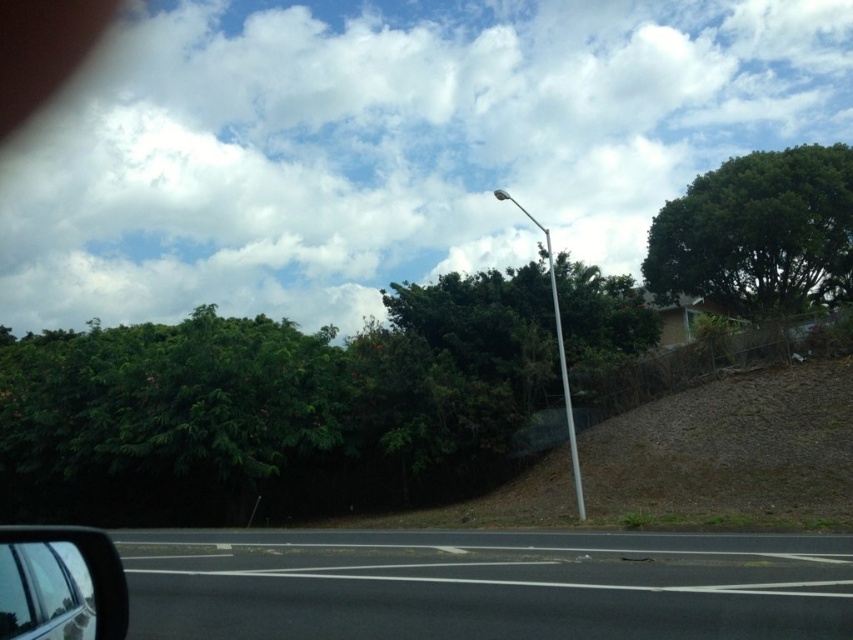
You are driving a car and want to check your blind spot. You have a clear plastic view mirror at lower left. Is the green leafy tree at center visible in the mirror?

The green leafy tree at center is 10.58 meters away from the clear plastic view mirror at lower left. Since the mirror is on the side of the car, it is unlikely to reflect objects that are 10.58 meters away and positioned at the center of the scene. Therefore, the tree is not visible in the mirror.

Based on the photo, you are driving a car and looking through the windshield. You see two points on the road ahead. The first point is at coordinate point (96,536) and the second point is at coordinate point (560,323). Which point is closer to your car?

Point (96,536) is in front of point (560,323), so the first point is closer to your car.